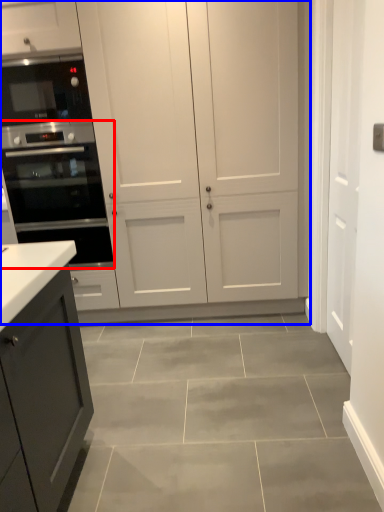
Question: Which object is further to the camera taking this photo, oven (highlighted by a red box) or cupboard (highlighted by a blue box)?

Choices:
 (A) oven
 (B) cupboard

Answer: (A)